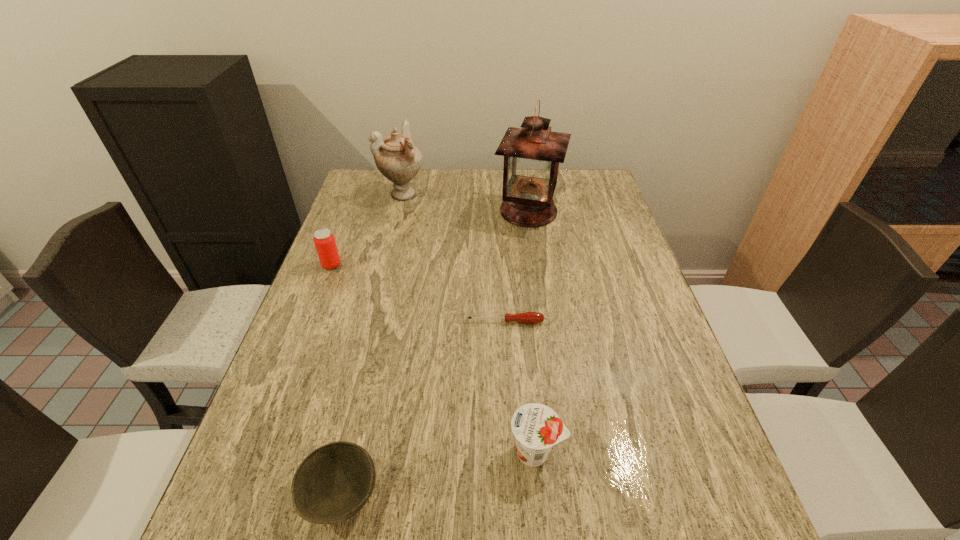
What are the coordinates of `vacant space that's between the beer can and the third nearest object` in the screenshot? It's located at coord(419,293).

The height and width of the screenshot is (540, 960). What are the coordinates of `free spot between the beer can and the tallest object` in the screenshot? It's located at (430, 238).

Locate an element on the screen. free space between the yogurt and the leftmost object is located at coordinates (434, 359).

This screenshot has height=540, width=960. What are the coordinates of `blank region between the screwdriver and the fourth tallest object` in the screenshot? It's located at 520,387.

Find the location of a particular element. unoccupied area between the yogurt and the second shortest object is located at coordinates (439, 473).

Identify the location of blank region between the tallest object and the fifth shortest object. pyautogui.click(x=466, y=202).

I want to click on object that can be found as the third closest to the fifth tallest object, so click(324, 240).

Where is `object that is the fifth closest one to the oil lamp`? This screenshot has width=960, height=540. object that is the fifth closest one to the oil lamp is located at coordinates (333, 483).

Where is `vacant point that satisfies the following two spatial constraints: 1. on the back side of the oil lamp; 2. on the left side of the fourth nearest object`? vacant point that satisfies the following two spatial constraints: 1. on the back side of the oil lamp; 2. on the left side of the fourth nearest object is located at coordinates (352, 211).

This screenshot has height=540, width=960. Identify the location of free space in the image that satisfies the following two spatial constraints: 1. on the back side of the urn; 2. on the left side of the beer can. (359, 194).